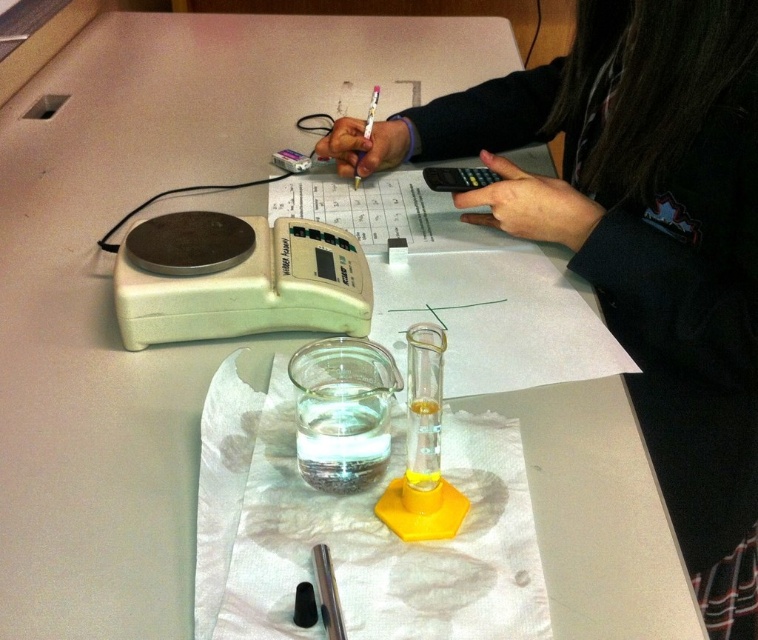
Image resolution: width=758 pixels, height=640 pixels. I want to click on white plastic electronic balance at center, so click(x=246, y=292).

Does white plastic electronic balance at center have a larger size compared to black plastic calculator at upper center?

Yes.

This screenshot has height=640, width=758. What do you see at coordinates (246, 292) in the screenshot? I see `white plastic electronic balance at center` at bounding box center [246, 292].

Find the location of a particular element. The width and height of the screenshot is (758, 640). white plastic electronic balance at center is located at coordinates [246, 292].